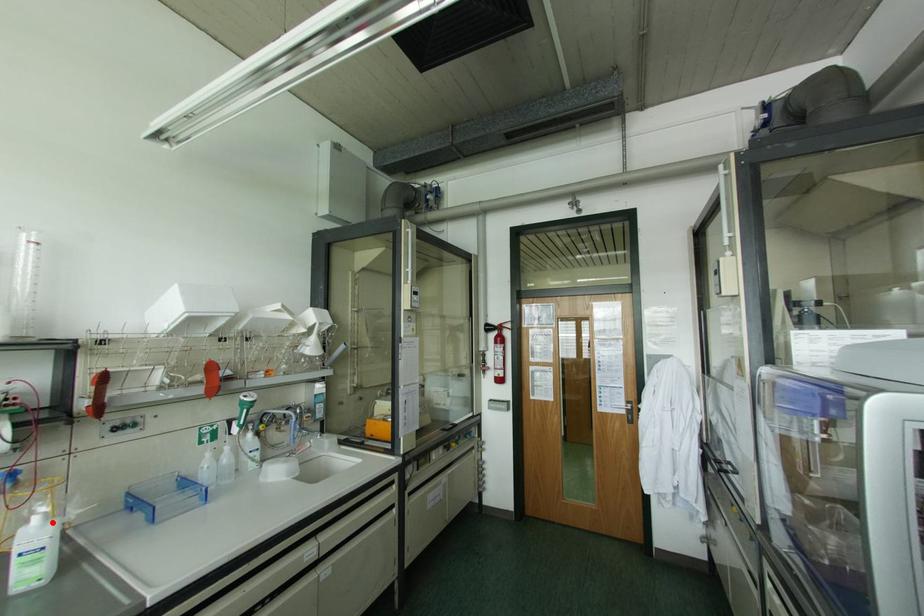
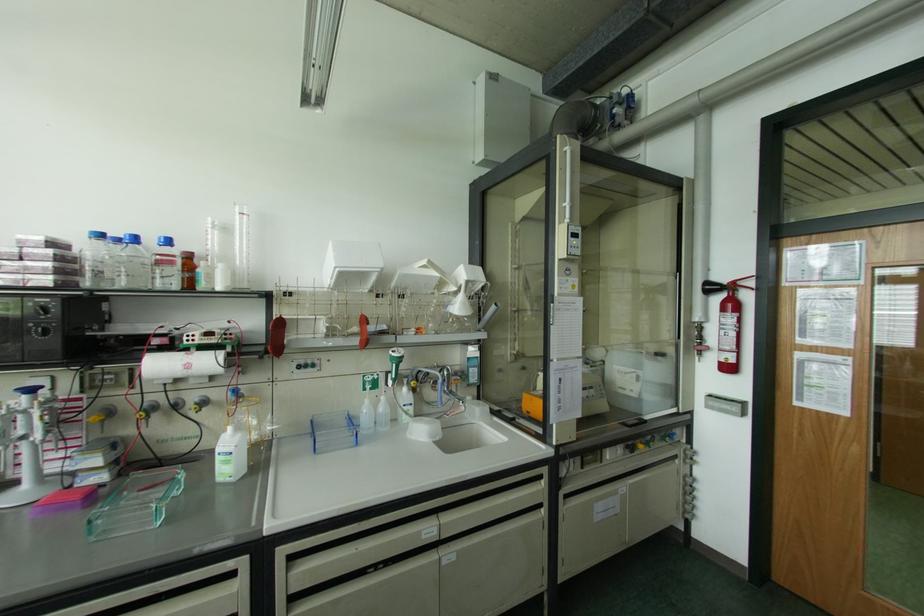
In the second image, find the point that corresponds to the highlighted location in the first image.

(238, 435)